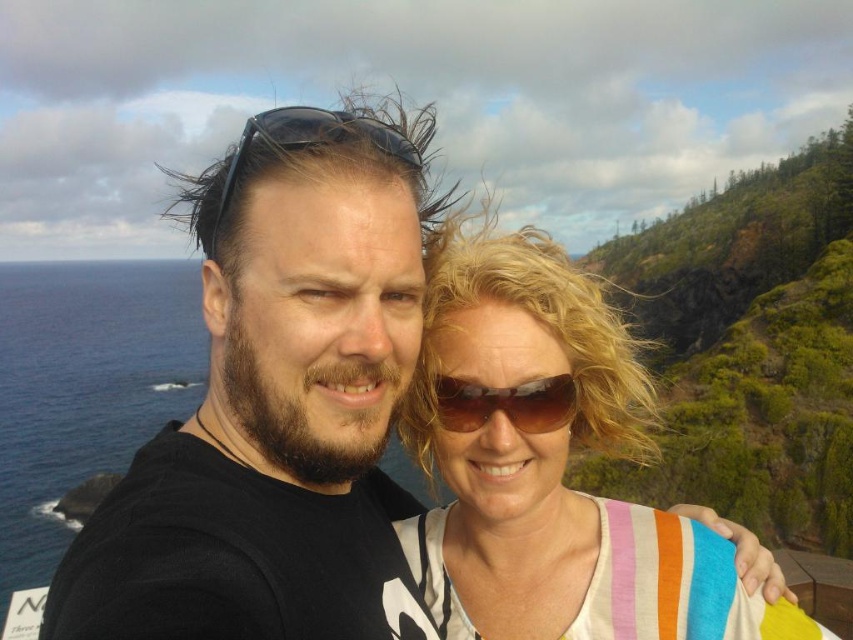
Is black matte sunglasses at upper center smaller than sunglasses at center?

No.

Who is positioned more to the right, black matte sunglasses at upper center or sunglasses at center?

sunglasses at center

This screenshot has height=640, width=853. Find the location of `black matte sunglasses at upper center`. black matte sunglasses at upper center is located at coordinates (309, 140).

Identify the location of black matte sunglasses at upper center. This screenshot has width=853, height=640. [309, 140].

Where is `white striped shirt at center`? This screenshot has width=853, height=640. white striped shirt at center is located at coordinates 521,444.

Is white striped shirt at center to the right of sunglasses at center from the viewer's perspective?

Correct, you'll find white striped shirt at center to the right of sunglasses at center.

Does point (518, 444) come closer to viewer compared to point (546, 403)?

No, (518, 444) is behind (546, 403).

Identify the location of white striped shirt at center. The height and width of the screenshot is (640, 853). (521, 444).

Which is more to the left, white striped shirt at center or black matte sunglasses at upper center?

Answer: Positioned to the left is black matte sunglasses at upper center.

Is the position of white striped shirt at center more distant than that of black matte sunglasses at upper center?

Yes, it is behind black matte sunglasses at upper center.

What do you see at coordinates (521, 444) in the screenshot? I see `white striped shirt at center` at bounding box center [521, 444].

Image resolution: width=853 pixels, height=640 pixels. In order to click on white striped shirt at center in this screenshot , I will do coord(521,444).